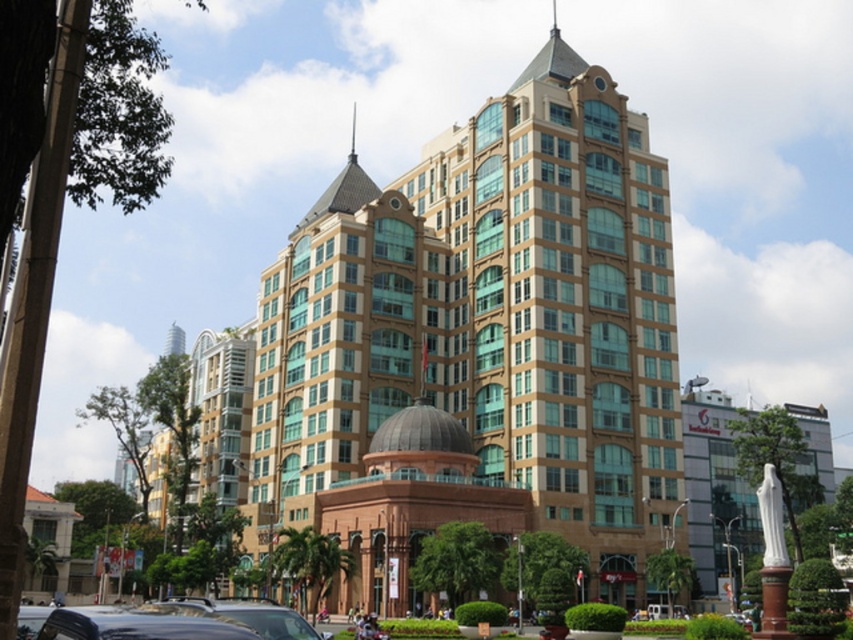
Question: Can you confirm if golden stone building at center is smaller than shiny black car at lower left?

Choices:
 (A) yes
 (B) no

Answer: (B)

Question: Does golden stone building at center have a greater width compared to shiny black car at lower left?

Choices:
 (A) no
 (B) yes

Answer: (B)

Question: Among these points, which one is farthest from the camera?

Choices:
 (A) (144, 627)
 (B) (520, 388)

Answer: (B)

Question: Which point is closer to the camera?

Choices:
 (A) golden stone building at center
 (B) shiny black car at lower left

Answer: (B)

Question: Can you confirm if golden stone building at center is wider than shiny black car at lower left?

Choices:
 (A) yes
 (B) no

Answer: (A)